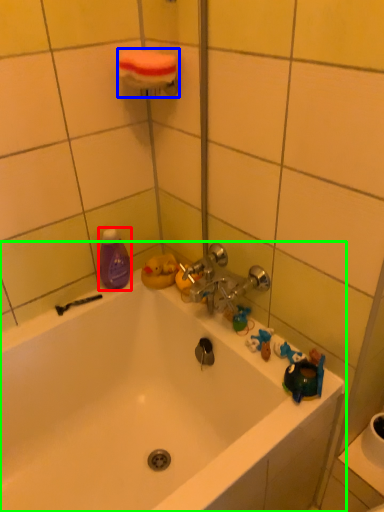
Question: Which object is the closest to the cleaning product (highlighted by a red box)? Choose among these: towel bar (highlighted by a blue box) or bathtub (highlighted by a green box).

Choices:
 (A) towel bar
 (B) bathtub

Answer: (B)